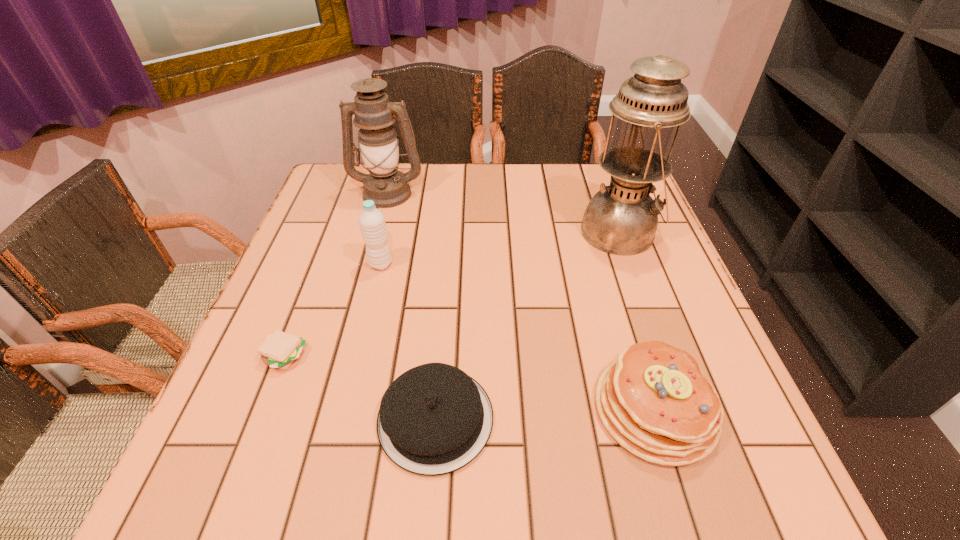
The width and height of the screenshot is (960, 540). Identify the location of the nearer oil lamp. (621, 219).

Where is `the tallest object`? The width and height of the screenshot is (960, 540). the tallest object is located at coordinates (621, 219).

This screenshot has height=540, width=960. Find the location of `the farthest object`. the farthest object is located at coordinates (374, 114).

This screenshot has width=960, height=540. Identify the location of the shorter oil lamp. click(x=374, y=114).

This screenshot has width=960, height=540. What are the coordinates of `water bottle` in the screenshot? It's located at (372, 224).

Where is `the third farthest object`? the third farthest object is located at coordinates (372, 224).

Identify the location of the fourth tallest object. (654, 401).

Image resolution: width=960 pixels, height=540 pixels. What are the coordinates of `the taller pancake` in the screenshot? It's located at (654, 401).

You are a GUI agent. You are given a task and a screenshot of the screen. Output one action in this format:
    pyautogui.click(x=<x>, y=<y>)
    Task: Click on the left pancake
    The image size is (960, 540).
    Given the screenshot: What is the action you would take?
    pyautogui.click(x=434, y=419)

Where is `the shorter pancake`? the shorter pancake is located at coordinates (434, 419).